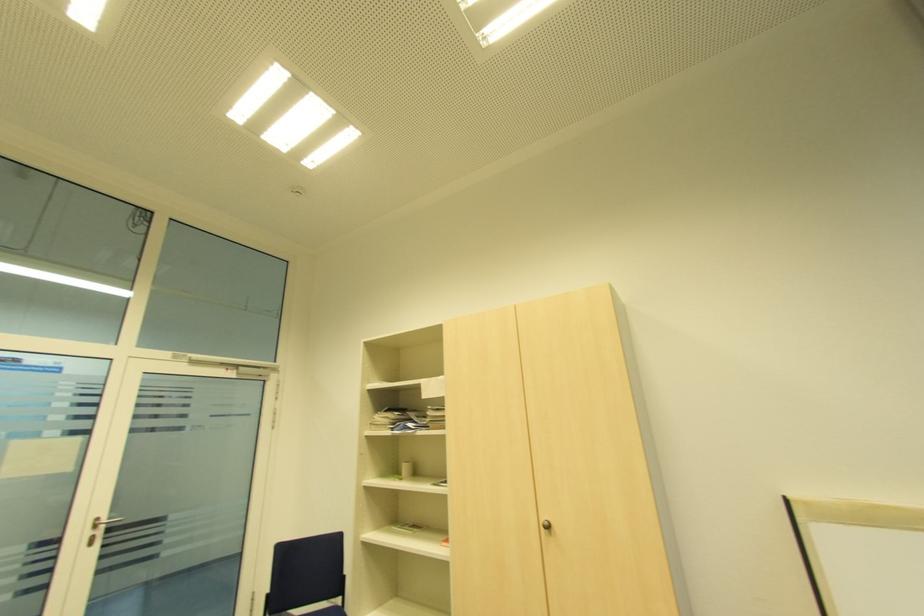
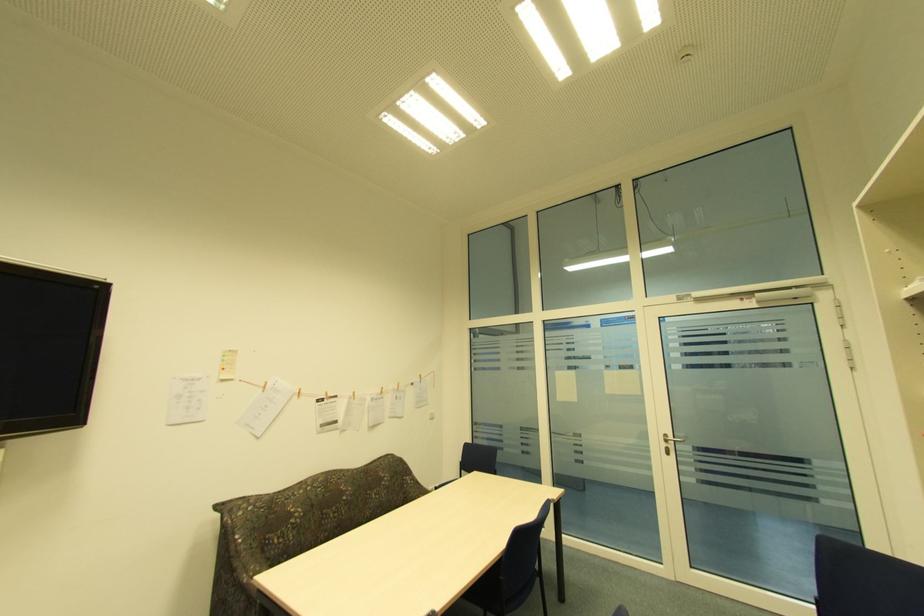
Locate, in the second image, the point that corresponds to (90,533) in the first image.

(666, 445)